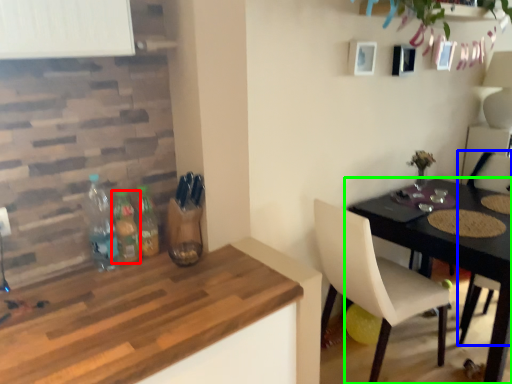
Question: Considering the real-world distances, which object is closest to bottle (highlighted by a red box)? chair (highlighted by a blue box) or table (highlighted by a green box).

Choices:
 (A) chair
 (B) table

Answer: (B)